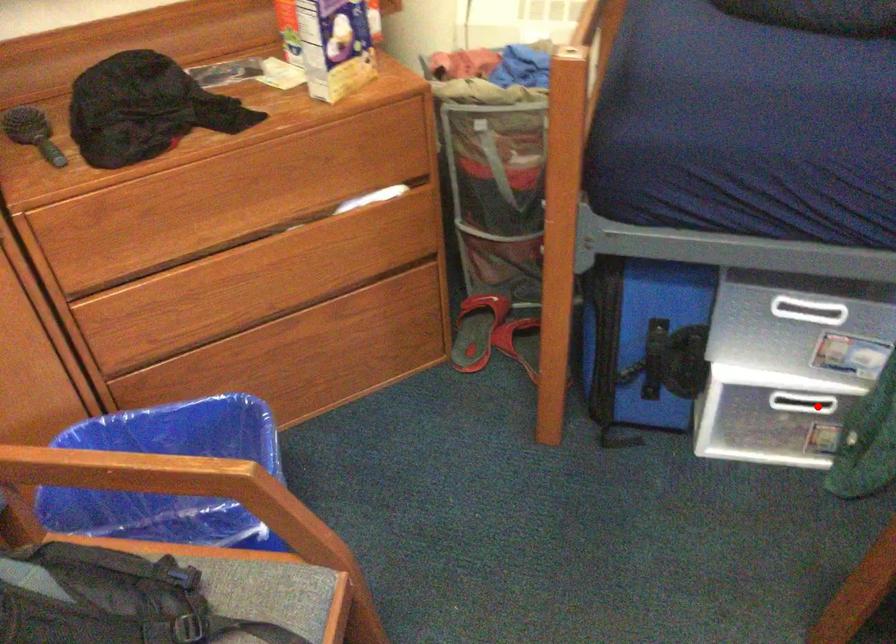
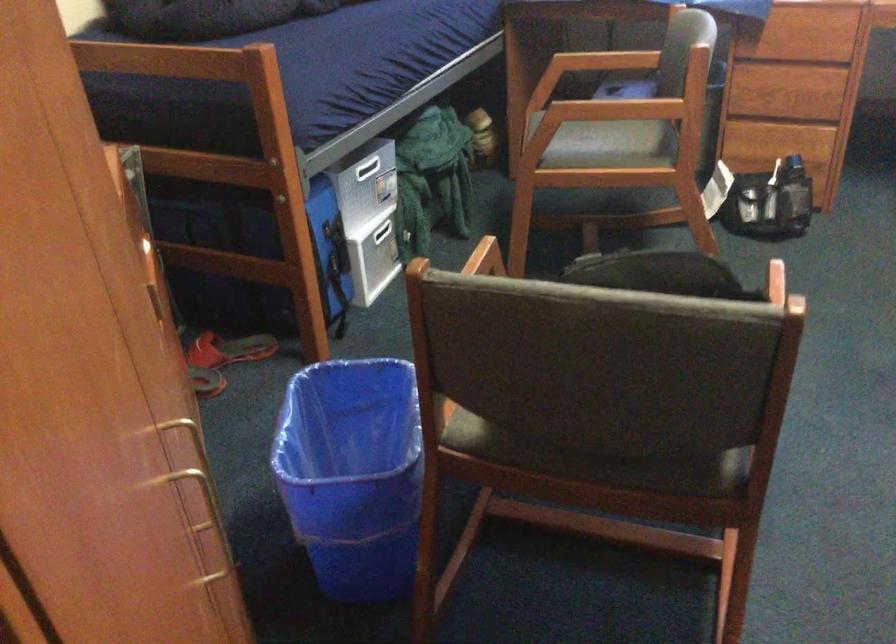
In the second image, find the point that corresponds to the highlighted location in the first image.

(383, 231)